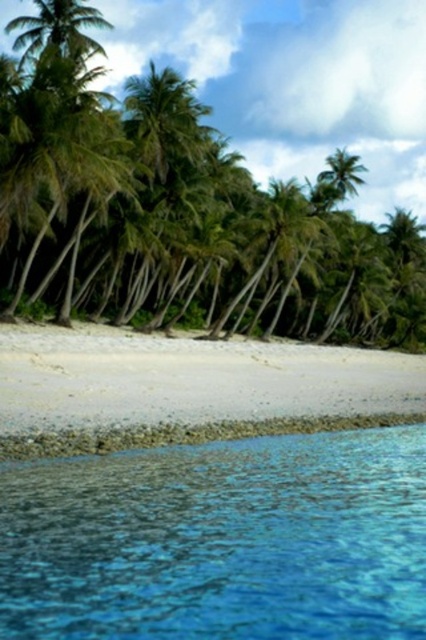
Question: Does clear blue water at lower center have a lesser width compared to white sand beach at lower center?

Choices:
 (A) no
 (B) yes

Answer: (B)

Question: In this image, where is clear blue water at lower center located relative to white sand beach at lower center?

Choices:
 (A) right
 (B) left

Answer: (B)

Question: Which of the following is the closest to the observer?

Choices:
 (A) clear blue water at lower center
 (B) white sand beach at lower center

Answer: (A)

Question: Which point is closer to the camera taking this photo?

Choices:
 (A) (299, 595)
 (B) (11, 404)

Answer: (A)

Question: Does clear blue water at lower center come in front of white sand beach at lower center?

Choices:
 (A) no
 (B) yes

Answer: (B)